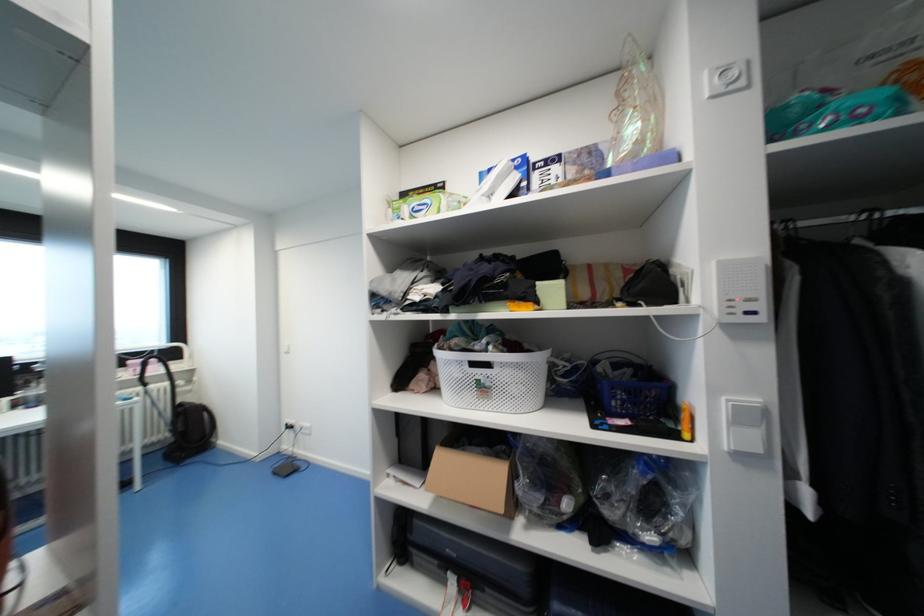
What do you see at coordinates (480, 366) in the screenshot? This screenshot has width=924, height=616. I see `the white basket handle` at bounding box center [480, 366].